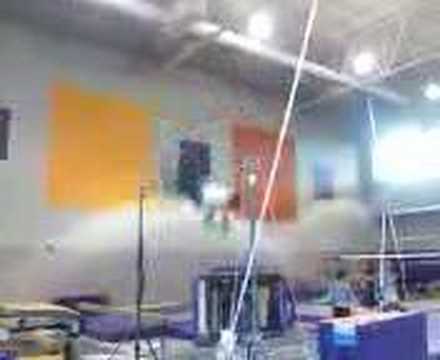
At what (x,y) coordinates should I click in order to perform the action: click on dark blue wall coverings. Please return your answer as a coordinate pair (x, y). This screenshot has width=440, height=360. Looking at the image, I should click on (5, 138), (181, 166).